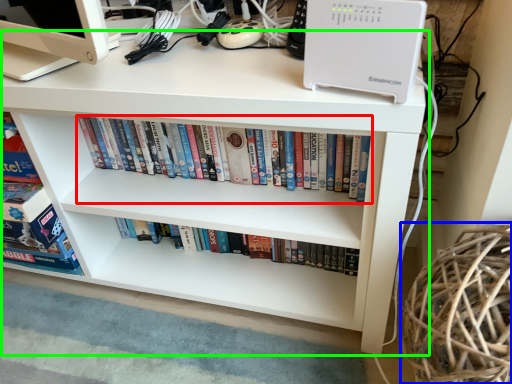
Question: Estimate the real-world distances between objects in this image. Which object is farther from book (highlighted by a red box), basket (highlighted by a blue box) or desk (highlighted by a green box)?

Choices:
 (A) basket
 (B) desk

Answer: (A)